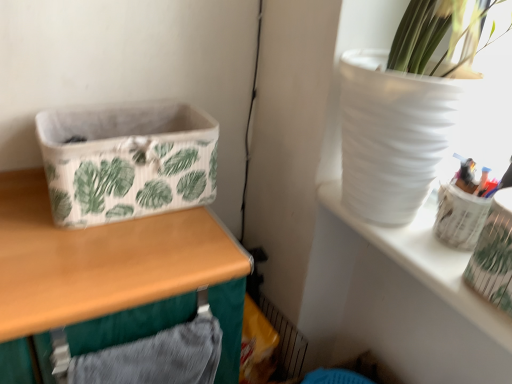
Find the location of a particular element. This screenshot has width=512, height=384. translucent plastic pen holder at upper right is located at coordinates (494, 254).

What is the approximate width of white matte vase at upper right?

white matte vase at upper right is 24.21 centimeters in width.

This screenshot has width=512, height=384. Describe the element at coordinates (426, 262) in the screenshot. I see `white matte vase at upper right` at that location.

What do you see at coordinates (127, 161) in the screenshot? I see `white fabric basket at left` at bounding box center [127, 161].

You are a GUI agent. You are given a task and a screenshot of the screen. Output one action in this format:
    pyautogui.click(x=<x>, y=<y>)
    Task: Click on the translucent plastic pen holder at upper right
    Image resolution: width=512 pixels, height=384 pixels.
    Given the screenshot: What is the action you would take?
    pyautogui.click(x=494, y=254)

Considering the positions of point (65, 241) and point (191, 120), is point (65, 241) closer or farther from the camera than point (191, 120)?

Point (65, 241).

From the picture: Is wooden table at left with white fabric basket at left?

They are not placed beside each other.

Find the location of a particular element. table on the left of white fabric basket at left is located at coordinates (99, 261).

Locate an element on the screen. This screenshot has height=384, width=512. basket container that appears behind the translucent plastic pen holder at upper right is located at coordinates (127, 161).

From a real-world perspective, does translucent plastic pen holder at upper right stand above white fabric basket at left?

Yes.

Is translucent plastic pen holder at upper right with white fabric basket at left?

They are not placed beside each other.

From the image's perspective, between translucent plastic pen holder at upper right and white fabric basket at left, which one is located above?

white fabric basket at left.

Where is `table located on the left of translucent plastic pen holder at upper right`? Image resolution: width=512 pixels, height=384 pixels. table located on the left of translucent plastic pen holder at upper right is located at coordinates (99, 261).

Which is farther from the camera, (187, 226) or (510, 257)?

Point (187, 226)

In the scene shown: Is wooden table at left aimed at translucent plastic pen holder at upper right?

No, wooden table at left does not turn towards translucent plastic pen holder at upper right.

Can you tell me how much white fabric basket at left and wooden table at left differ in facing direction?

0.2 degrees.

How distant is white fabric basket at left from wooden table at left?

The distance of white fabric basket at left from wooden table at left is 5.32 inches.

From the picture: From the image's perspective, is white fabric basket at left on wooden table at left?

Correct, white fabric basket at left appears higher than wooden table at left in the image.

Can you confirm if white fabric basket at left is wider than wooden table at left?

Incorrect, the width of white fabric basket at left does not surpass that of wooden table at left.

Is wooden table at left next to white matte vase at upper right?

They are not placed beside each other.

Do you think wooden table at left is within white matte vase at upper right, or outside of it?

wooden table at left lies outside white matte vase at upper right.

Is wooden table at left looking in the opposite direction of white matte vase at upper right?

No.

Considering the sizes of objects wooden table at left and white matte vase at upper right in the image provided, who is smaller, wooden table at left or white matte vase at upper right?

white matte vase at upper right.

From a real-world perspective, who is located higher, white matte vase at upper right or wooden table at left?

From a 3D spatial view, white matte vase at upper right is above.

From the image's perspective, which object appears higher, white matte vase at upper right or wooden table at left?

white matte vase at upper right is shown above in the image.

Is white matte vase at upper right surrounding wooden table at left?

No.

Is white fabric basket at left looking in the opposite direction of white matte vase at upper right?

That's not correct — white fabric basket at left is not looking away from white matte vase at upper right.

Does point (126, 118) come in front of point (484, 323)?

No, (126, 118) is behind (484, 323).

Does white fabric basket at left touch white matte vase at upper right?

No, white fabric basket at left is not touching white matte vase at upper right.

Which object is closer to the camera, white fabric basket at left or white matte vase at upper right?

white matte vase at upper right is more forward.

This screenshot has width=512, height=384. In order to click on table in front of the white fabric basket at left in this screenshot , I will do `click(99, 261)`.

You are a GUI agent. You are given a task and a screenshot of the screen. Output one action in this format:
    pyautogui.click(x=<x>, y=<y>)
    Task: Click on the vase positioned vertically above the white fabric basket at left (from a real-world perspective)
    The height and width of the screenshot is (384, 512).
    Given the screenshot: What is the action you would take?
    pyautogui.click(x=494, y=254)

Based on their spatial positions, is white fabric basket at left or translucent plastic pen holder at upper right closer to wooden table at left?

white fabric basket at left is closer to wooden table at left.

Considering their positions, is wooden table at left positioned further to white fabric basket at left than white matte vase at upper right?

white matte vase at upper right is positioned further to the anchor white fabric basket at left.

Looking at this image, based on their spatial positions, is wooden table at left or translucent plastic pen holder at upper right further from white fabric basket at left?

translucent plastic pen holder at upper right is positioned further to the anchor white fabric basket at left.

When comparing their distances from white matte vase at upper right, does translucent plastic pen holder at upper right or white fabric basket at left seem further?

white fabric basket at left.

From the image, which object appears to be nearer to white matte vase at upper right, white fabric basket at left or translucent plastic pen holder at upper right?

Based on the image, translucent plastic pen holder at upper right appears to be nearer to white matte vase at upper right.

Which object lies further to the anchor point wooden table at left, white matte vase at upper right or translucent plastic pen holder at upper right?

Based on the image, translucent plastic pen holder at upper right appears to be further to wooden table at left.

Which object lies nearer to the anchor point translucent plastic pen holder at upper right, wooden table at left or white matte vase at upper right?

The object closer to translucent plastic pen holder at upper right is white matte vase at upper right.

When comparing their distances from translucent plastic pen holder at upper right, does white fabric basket at left or white matte vase at upper right seem closer?

white matte vase at upper right lies closer to translucent plastic pen holder at upper right than the other object.

Find the location of a particular element. The image size is (512, 384). shelf between wooden table at left and translucent plastic pen holder at upper right in the horizontal direction is located at coordinates (426, 262).

You are a GUI agent. You are given a task and a screenshot of the screen. Output one action in this format:
    pyautogui.click(x=<x>, y=<y>)
    Task: Click on the basket container situated between wooden table at left and white matte vase at upper right from left to right
    
    Given the screenshot: What is the action you would take?
    pyautogui.click(x=127, y=161)

Locate an element on the screen. Image resolution: width=512 pixels, height=384 pixels. basket container between wooden table at left and translucent plastic pen holder at upper right is located at coordinates (127, 161).

At what (x,y) coordinates should I click in order to perform the action: click on shelf between white fabric basket at left and translucent plastic pen holder at upper right from left to right. Please return your answer as a coordinate pair (x, y). Looking at the image, I should click on (426, 262).